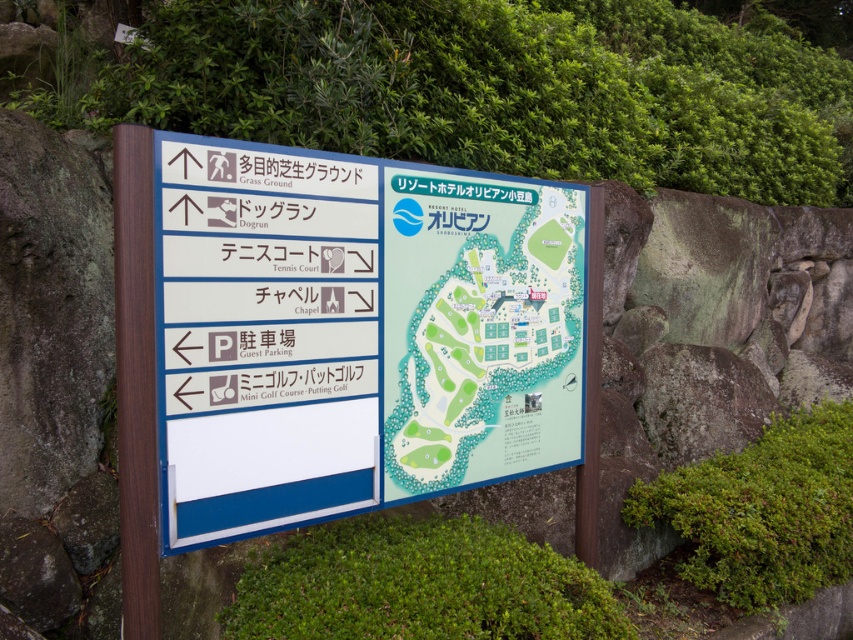
Question: Can you confirm if wooden signboard at center is positioned above green paper map at center?

Choices:
 (A) no
 (B) yes

Answer: (A)

Question: Does wooden signboard at center have a larger size compared to green paper map at center?

Choices:
 (A) no
 (B) yes

Answer: (B)

Question: Can you confirm if wooden signboard at center is wider than green paper map at center?

Choices:
 (A) no
 (B) yes

Answer: (B)

Question: Which object is farther from the camera taking this photo?

Choices:
 (A) wooden signboard at center
 (B) green paper map at center

Answer: (B)

Question: Among these points, which one is nearest to the camera?

Choices:
 (A) (535, 436)
 (B) (158, 314)

Answer: (B)